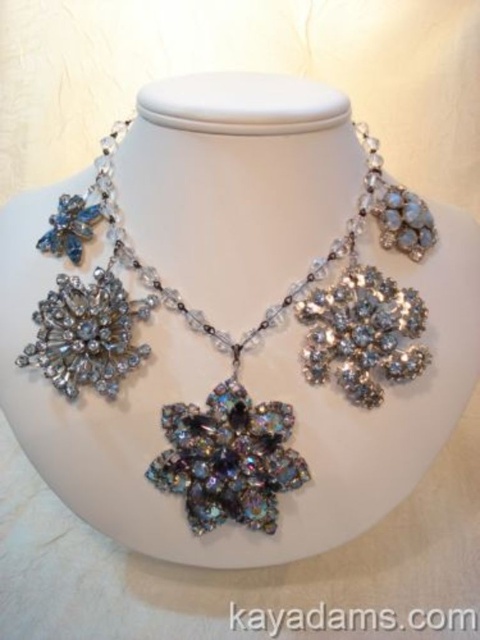
Between iridescent crystal flower at center and iridescent crystal flower at lower left, which one is positioned lower?

iridescent crystal flower at lower left

Can you confirm if iridescent crystal flower at center is wider than iridescent crystal flower at lower left?

Incorrect, iridescent crystal flower at center's width does not surpass iridescent crystal flower at lower left's.

Is point (357, 284) more distant than point (75, 387)?

Yes, point (357, 284) is behind point (75, 387).

This screenshot has width=480, height=640. Find the location of `iridescent crystal flower at center`. iridescent crystal flower at center is located at coordinates (362, 333).

Is iridescent crystal necklace at center thinner than iridescent crystal flower at center?

No.

Is point (111, 266) farther from camera compared to point (342, 390)?

Yes.

The width and height of the screenshot is (480, 640). What are the coordinates of `iridescent crystal necklace at center` in the screenshot? It's located at (232, 342).

Does iridescent crystal necklace at center have a larger size compared to iridescent crystal flower at lower left?

Yes, iridescent crystal necklace at center is bigger than iridescent crystal flower at lower left.

Who is shorter, iridescent crystal necklace at center or iridescent crystal flower at lower left?

iridescent crystal flower at lower left

Locate an element on the screen. iridescent crystal necklace at center is located at coordinates (232, 342).